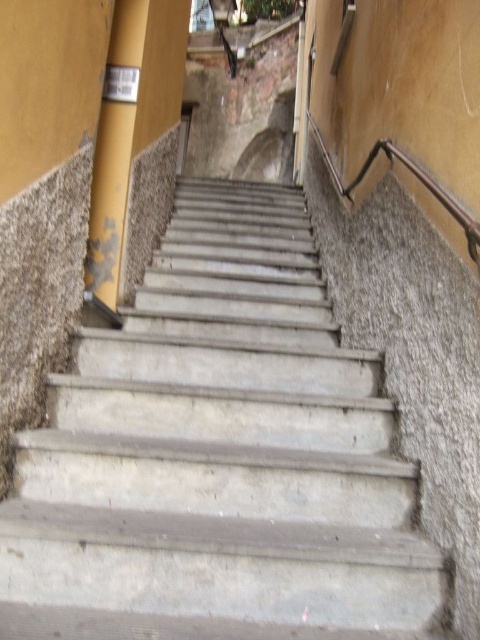
Is point (379, 547) farther from viewer compared to point (131, 154)?

No, it is in front of (131, 154).

Is concrete stairs at center below yellow matte pole at upper left?

Yes, concrete stairs at center is below yellow matte pole at upper left.

Who is more distant from viewer, (420, 588) or (113, 70)?

The point (113, 70) is behind.

What are the coordinates of `concrete stairs at center` in the screenshot? It's located at (218, 456).